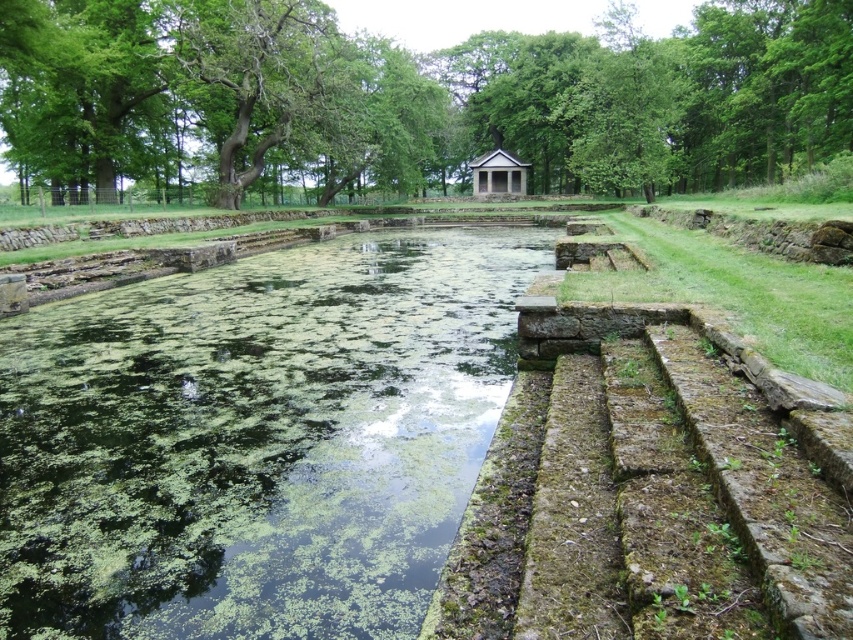
Question: Is green algae-covered water at center below white stone gazebo at center?

Choices:
 (A) yes
 (B) no

Answer: (A)

Question: Which point appears farthest from the camera in this image?

Choices:
 (A) (515, 172)
 (B) (85, 490)

Answer: (A)

Question: Considering the relative positions of green algae-covered water at center and white stone gazebo at center in the image provided, where is green algae-covered water at center located with respect to white stone gazebo at center?

Choices:
 (A) below
 (B) above

Answer: (A)

Question: Can you confirm if green algae-covered water at center is smaller than white stone gazebo at center?

Choices:
 (A) no
 (B) yes

Answer: (A)

Question: Which point is closer to the camera?

Choices:
 (A) white stone gazebo at center
 (B) green algae-covered water at center

Answer: (B)